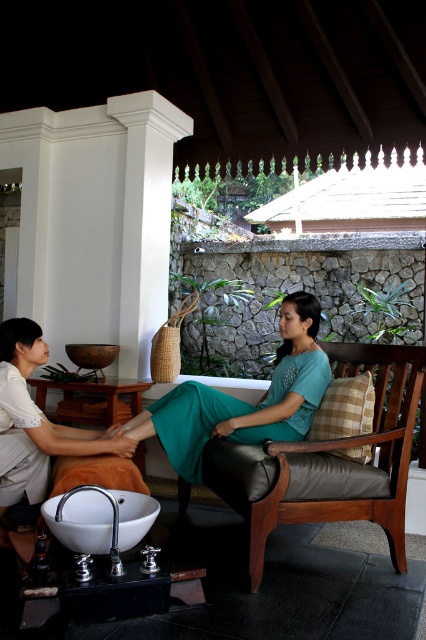
Question: Which point is closer to the camera?

Choices:
 (A) (186, 420)
 (B) (331, 481)

Answer: (B)

Question: Does leather cushioned chair at center have a greater width compared to teal matte dress at center?

Choices:
 (A) yes
 (B) no

Answer: (B)

Question: Where is leather cushioned chair at center located in relation to teal matte dress at center in the image?

Choices:
 (A) left
 (B) right

Answer: (B)

Question: Can you confirm if leather cushioned chair at center is positioned to the right of teal matte dress at center?

Choices:
 (A) no
 (B) yes

Answer: (B)

Question: Which point is farther to the camera?

Choices:
 (A) (226, 467)
 (B) (195, 385)

Answer: (B)

Question: Among these objects, which one is nearest to the camera?

Choices:
 (A) leather cushioned chair at center
 (B) teal matte dress at center

Answer: (A)